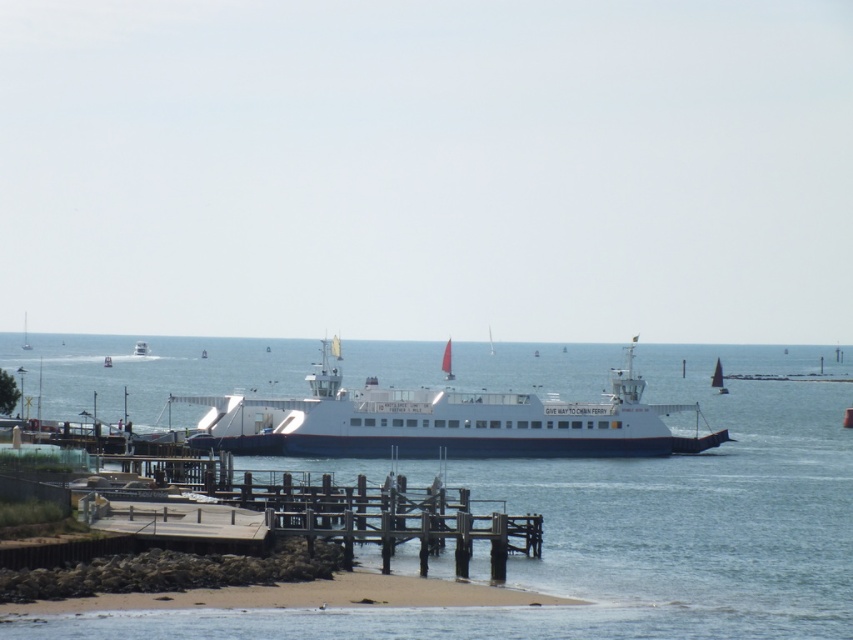
Question: Is blue water at center thinner than white matte boat at center?

Choices:
 (A) yes
 (B) no

Answer: (B)

Question: Does blue water at center appear on the left side of wooden pier at lower left?

Choices:
 (A) no
 (B) yes

Answer: (B)

Question: Which of the following is the farthest from the observer?

Choices:
 (A) (283, 531)
 (B) (567, 452)
 (C) (714, 396)

Answer: (C)

Question: Is the position of blue water at center less distant than that of wooden pier at lower left?

Choices:
 (A) no
 (B) yes

Answer: (B)

Question: Which object is closer to the camera taking this photo?

Choices:
 (A) wooden pier at lower left
 (B) white matte boat at center
 (C) white matte ferry at center
 (D) blue water at center

Answer: (D)

Question: Estimate the real-world distances between objects in this image. Which object is closer to the wooden pier at lower left?

Choices:
 (A) blue water at center
 (B) white matte ferry at center
 (C) white matte boat at center

Answer: (B)